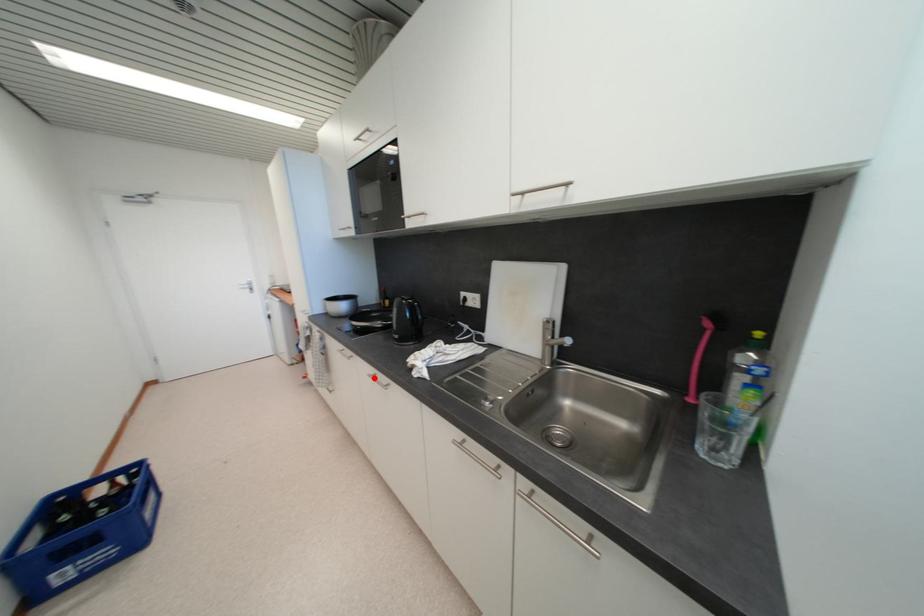
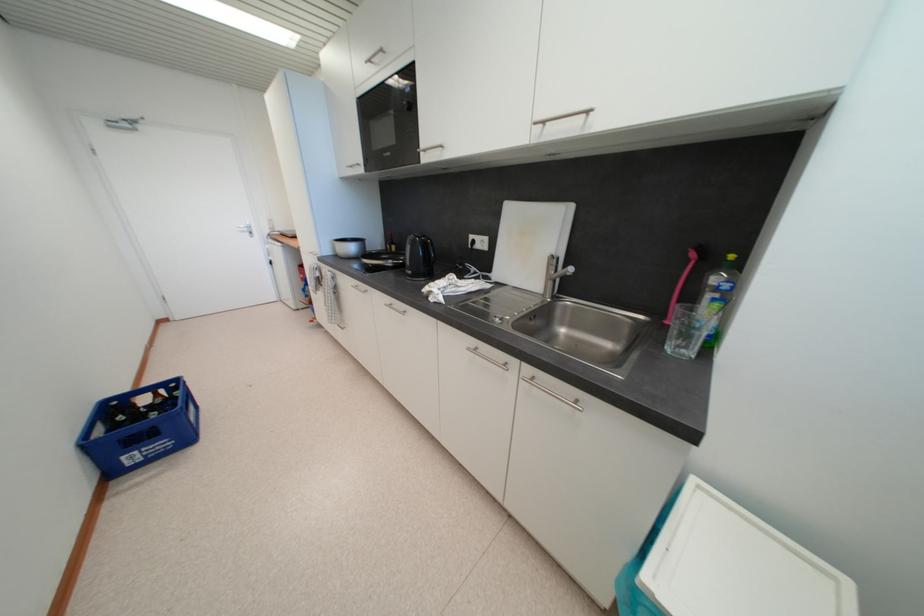
Question: I am providing you with two images of the same scene from different viewpoints. A red point is shown in image1. For the corresponding object point in image2, is it positioned nearer or farther from the camera?

Choices:
 (A) Nearer
 (B) Farther

Answer: (A)